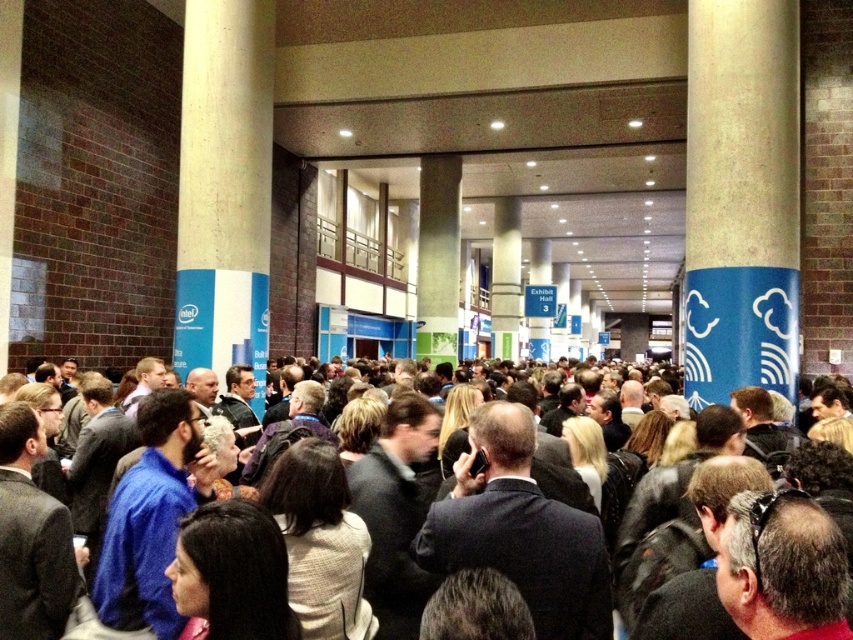
Question: Does dark suit at center have a greater width compared to smooth concrete pillar at left?

Choices:
 (A) no
 (B) yes

Answer: (A)

Question: Can you confirm if dark suit at center is wider than smooth concrete pillar at left?

Choices:
 (A) yes
 (B) no

Answer: (B)

Question: Which object appears farthest from the camera in this image?

Choices:
 (A) dark suit at center
 (B) smooth concrete pillar at left

Answer: (B)

Question: Is blue textured pillar at right wider than smooth concrete pillar at left?

Choices:
 (A) yes
 (B) no

Answer: (B)

Question: Which of the following is the farthest from the observer?

Choices:
 (A) blue textured pillar at right
 (B) smooth concrete pillar at left
 (C) dark suit at center

Answer: (B)

Question: Which of the following is the closest to the observer?

Choices:
 (A) smooth concrete pillar at left
 (B) dark suit at center
 (C) blue textured pillar at right

Answer: (B)